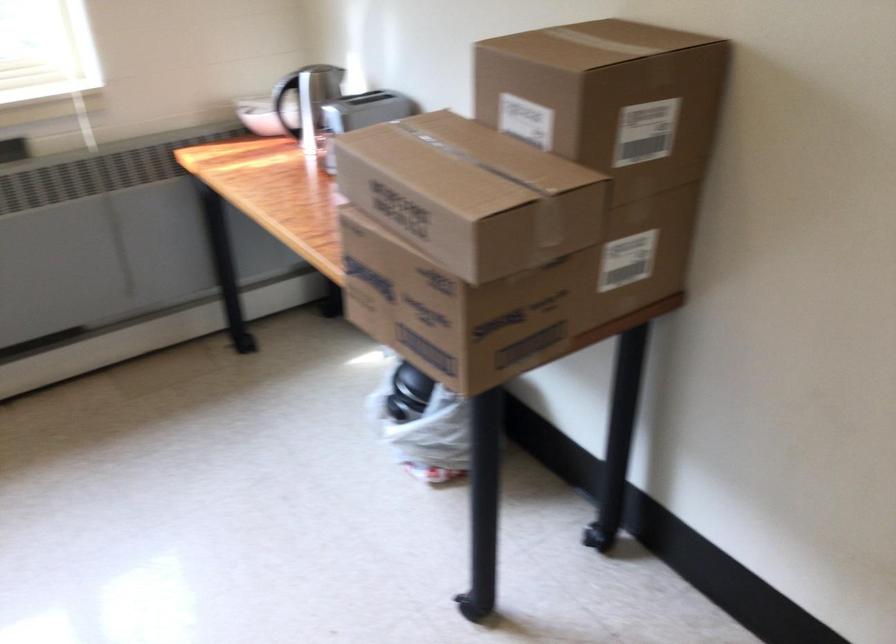
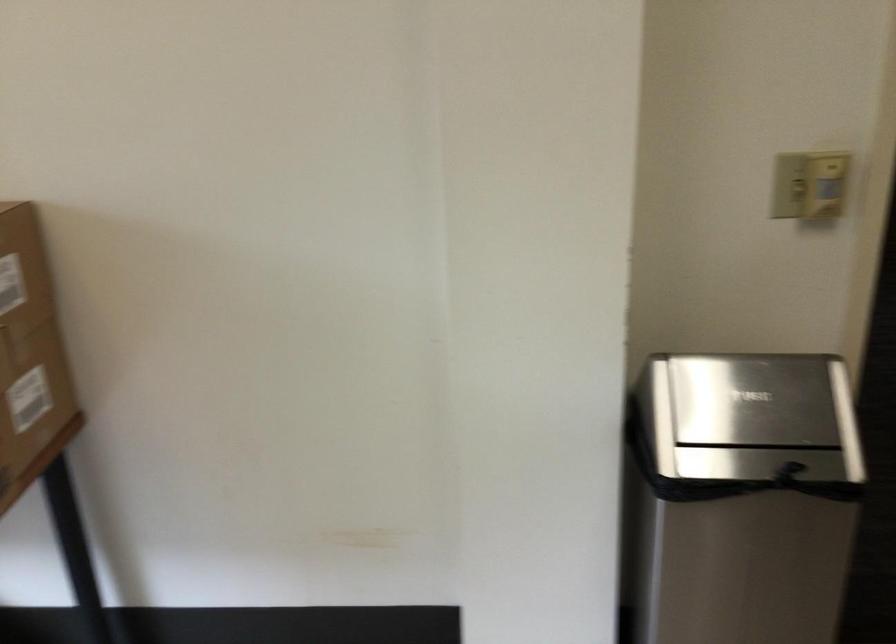
Question: The first image is from the beginning of the video and the second image is from the end. How did the camera likely rotate when shooting the video?

Choices:
 (A) Left
 (B) Right
 (C) Up
 (D) Down

Answer: (B)